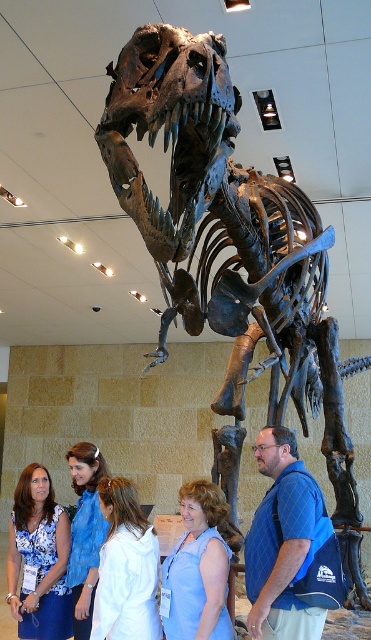
Question: Estimate the real-world distances between objects in this image. Which object is farther from the blue denim shirt at lower left?

Choices:
 (A) blue sleeveless top at center
 (B) white fabric shirt at center

Answer: (A)

Question: Which object appears farthest from the camera in this image?

Choices:
 (A) blue fabric backpack at center
 (B) blue denim shirt at lower left
 (C) white fabric shirt at center

Answer: (B)

Question: Does rusty metal skeleton at center come in front of blue denim shirt at lower left?

Choices:
 (A) yes
 (B) no

Answer: (A)

Question: Does blue sleeveless top at center have a lesser width compared to white fabric shirt at center?

Choices:
 (A) yes
 (B) no

Answer: (A)

Question: Which of the following is the farthest from the observer?

Choices:
 (A) (132, 605)
 (B) (83, 490)
 (C) (57, 634)
 (D) (178, 604)

Answer: (B)

Question: Does white fabric shirt at center appear over blue denim shirt at lower left?

Choices:
 (A) yes
 (B) no

Answer: (A)